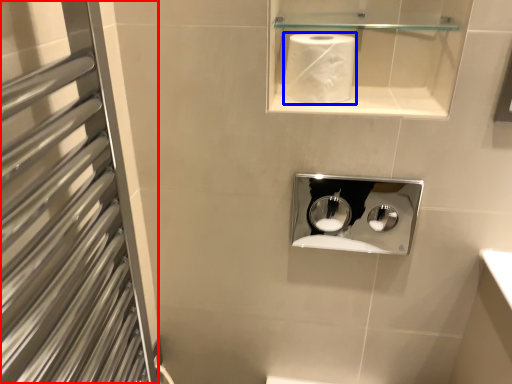
Question: Which of the following is the closest to the observer, screen door (highlighted by a red box) or paper towel (highlighted by a blue box)?

Choices:
 (A) screen door
 (B) paper towel

Answer: (A)